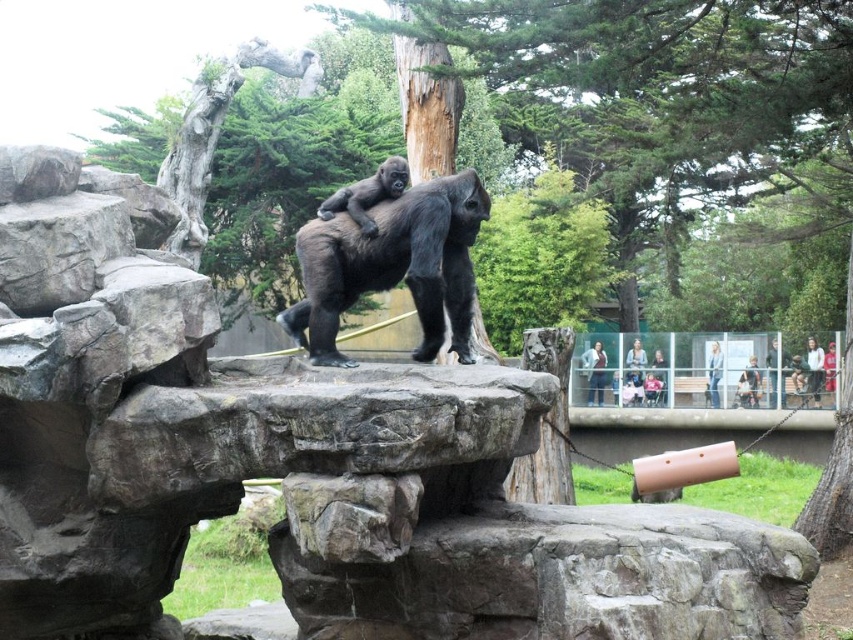
Between rough textured rock at center and shiny black gorilla at center, which one has less height?

Standing shorter between the two is shiny black gorilla at center.

Is point (111, 634) closer to camera compared to point (469, 220)?

No, it is behind (469, 220).

Describe the element at coordinates (305, 465) in the screenshot. I see `rough textured rock at center` at that location.

This screenshot has height=640, width=853. Find the location of `rough textured rock at center`. rough textured rock at center is located at coordinates (305, 465).

Can you confirm if rough textured rock at center is shorter than brown concrete ledge at lower right?

Incorrect, rough textured rock at center's height does not fall short of brown concrete ledge at lower right's.

Is rough textured rock at center smaller than brown concrete ledge at lower right?

Actually, rough textured rock at center might be larger than brown concrete ledge at lower right.

Does point (419, 570) come behind point (727, 413)?

No.

Identify the location of rough textured rock at center. Image resolution: width=853 pixels, height=640 pixels. (305, 465).

Does shiny black gorilla at center lie behind black matte gorilla at center?

No, it is not.

Is point (477, 180) less distant than point (376, 182)?

Yes.

Locate an element on the screen. This screenshot has width=853, height=640. shiny black gorilla at center is located at coordinates (393, 266).